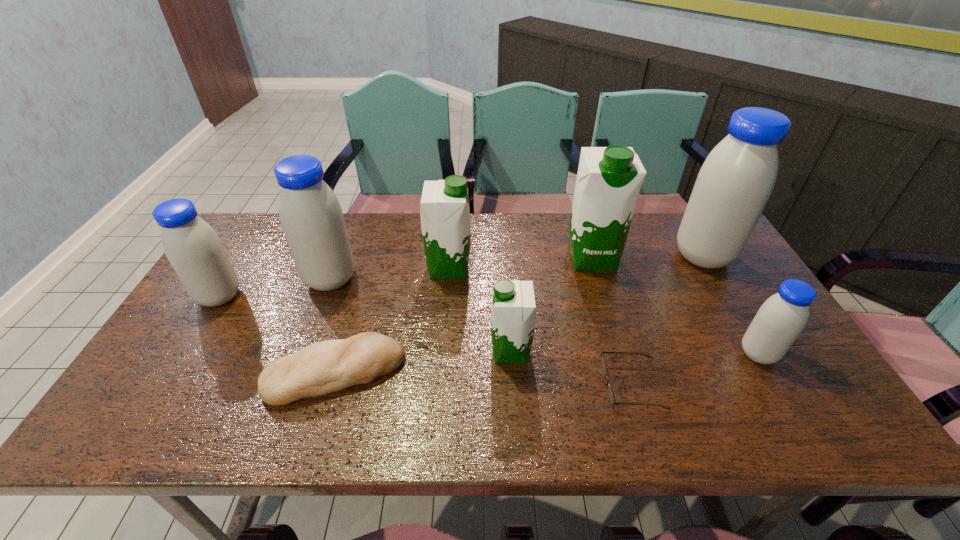
Choose which soya milk is the fourth nearest neighbor to the spectacles. Please provide its 2D coordinates. Your answer should be formatted as a tuple, i.e. [(x, y)], where the tuple contains the x and y coordinates of a point satisfying the conditions above.

[(737, 178)]

Select which blue soya milk is the closest to the second smallest blue soya milk. Please provide its 2D coordinates. Your answer should be formatted as a tuple, i.e. [(x, y)], where the tuple contains the x and y coordinates of a point satisfying the conditions above.

[(311, 217)]

Locate an element on the screen. This screenshot has height=540, width=960. the closest blue soya milk to the fourth object from left to right is located at coordinates (311, 217).

Identify which green soya milk is the second nearest to the fourth soya milk from right to left. Please provide its 2D coordinates. Your answer should be formatted as a tuple, i.e. [(x, y)], where the tuple contains the x and y coordinates of a point satisfying the conditions above.

[(609, 179)]

At what (x,y) coordinates should I click in order to perform the action: click on the closest green soya milk to the fifth soya milk from left to right. Please return your answer as a coordinate pair (x, y). Looking at the image, I should click on pyautogui.click(x=513, y=314).

This screenshot has height=540, width=960. In order to click on vacant point that satisfies the following two spatial constraints: 1. on the front-facing side of the smallest green soya milk; 2. on the left side of the nearest blue soya milk in this screenshot , I will do `click(511, 354)`.

Locate an element on the screen. This screenshot has width=960, height=540. free space that satisfies the following two spatial constraints: 1. on the front side of the third smallest blue soya milk; 2. on the right side of the brown bread is located at coordinates (296, 373).

You are a GUI agent. You are given a task and a screenshot of the screen. Output one action in this format:
    pyautogui.click(x=<x>, y=<y>)
    Task: Click on the free spot that satisfies the following two spatial constraints: 1. on the front-facing side of the sixth object from right to left; 2. on the left side of the nearest blue soya milk
    This screenshot has height=540, width=960.
    Given the screenshot: What is the action you would take?
    pyautogui.click(x=442, y=354)

At what (x,y) coordinates should I click in order to perform the action: click on vacant region that satisfies the following two spatial constraints: 1. on the front-facing side of the leftmost green soya milk; 2. on the front side of the brown bread. Please return your answer as a coordinate pair (x, y). This screenshot has width=960, height=540. Looking at the image, I should click on (440, 373).

Image resolution: width=960 pixels, height=540 pixels. Identify the location of vacant area that satisfies the following two spatial constraints: 1. on the front-facing side of the rightmost green soya milk; 2. on the left side of the smallest blue soya milk. (620, 354).